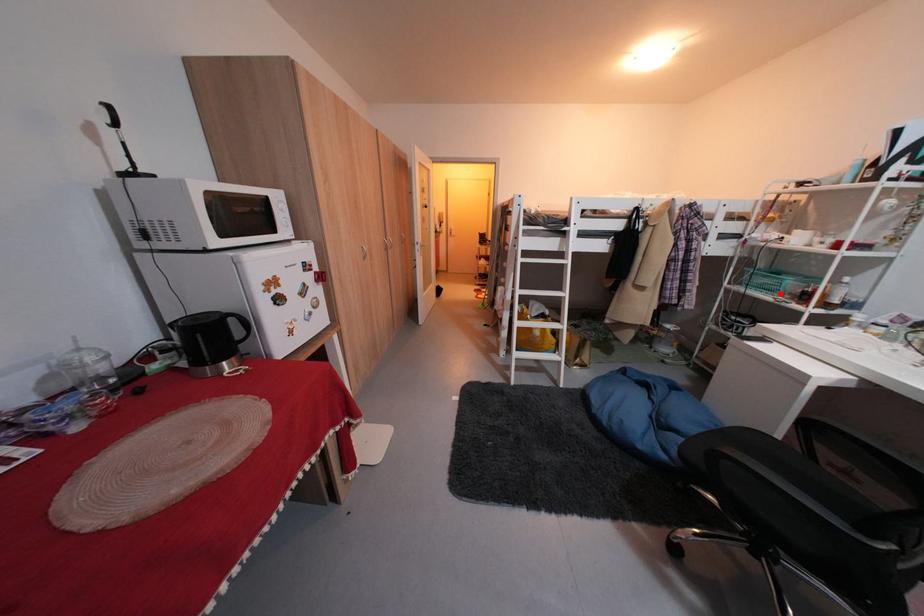
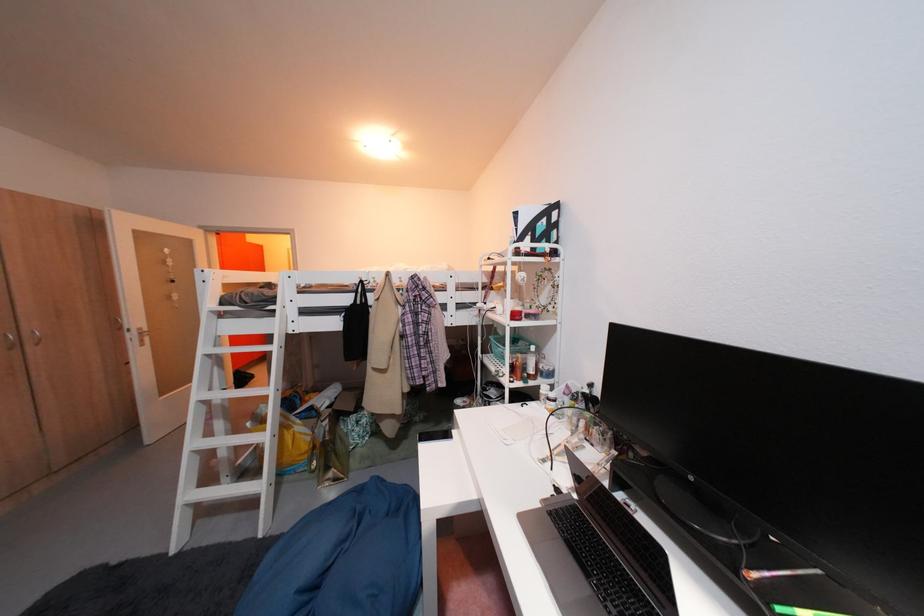
The point at the highlighted location is marked in the first image. Where is the corresponding point in the second image?

(514, 363)